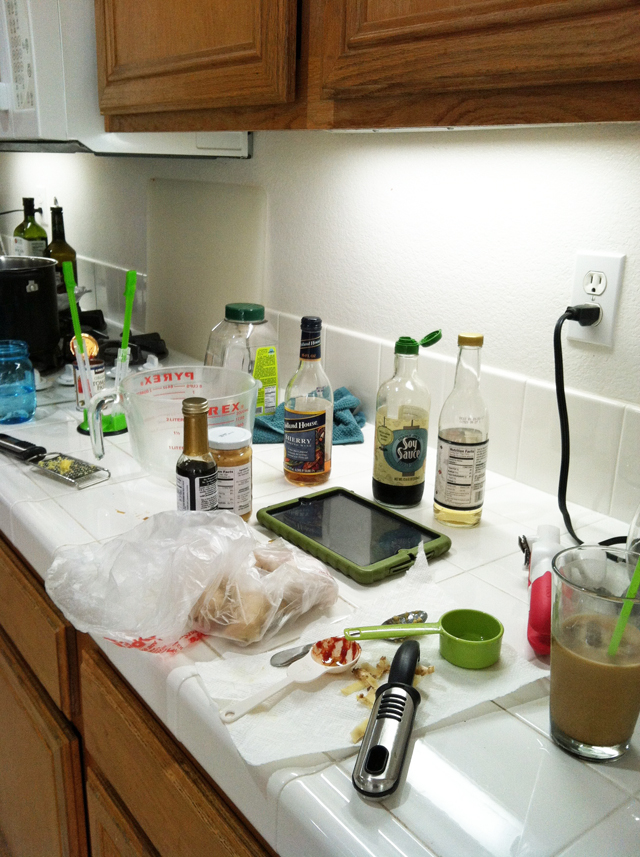
Image resolution: width=640 pixels, height=857 pixels. I want to click on green straw in clear glass, so click(x=635, y=578).